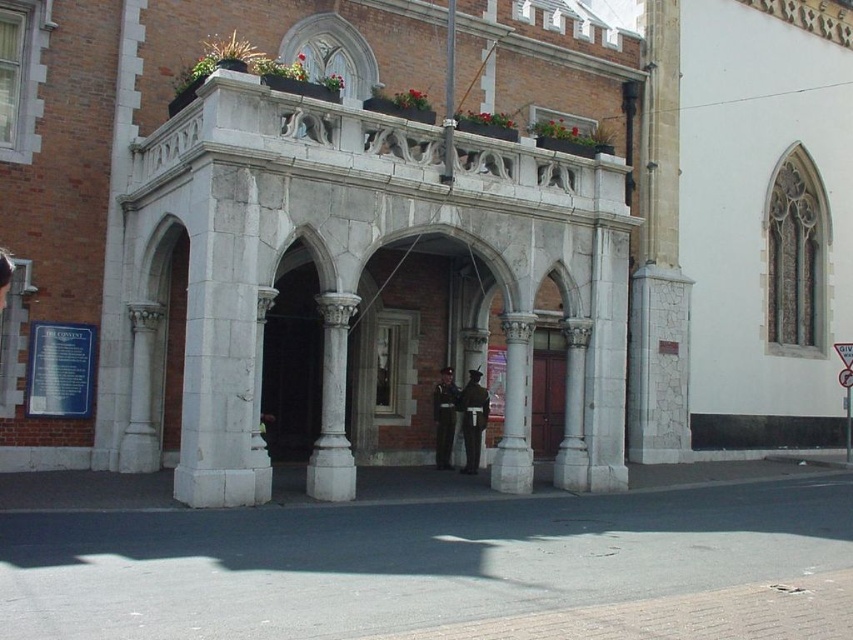
You are standing in front of the historic building and want to enter through the brown wooden door at center. Which direction should you walk to reach the door first, considering the white marble column at center is blocking your path?

The white marble column at center is positioned under the brown wooden door at center, meaning the column is directly below the door. To reach the door, you should walk towards the column since it is located beneath the door, indicating they are aligned vertically. However, if the column is blocking the path, you might need to navigate around it by moving to the side of the column to access the door.

You are standing in front of a historic building with a grand portico. You see a brown wooden door at center and a metallic rectangular sign at center. Which object is positioned to the left from your perspective?

The brown wooden door at center is to the left of the metallic rectangular sign at center.